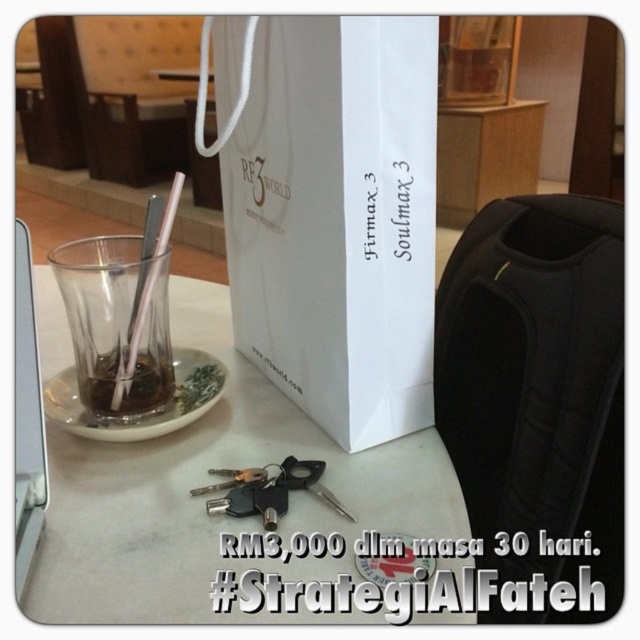
In the scene described, there is a transparent glass at center and a translucent glass cup at center. Which of these two items is larger in size?

The transparent glass at center is bigger than the translucent glass cup at center.

You are sitting at the table in the image and want to grab the transparent glass at center to drink from it. However, there is also a translucent glass cup at center nearby. Which one is easier to reach without moving your arm too much?

The transparent glass at center is closer to the viewer, so it would be easier to reach without moving your arm too much compared to the translucent glass cup at center.

You are a photographer adjusting your camera to focus on two points on the table. The first point is at coordinates point (x=138, y=396) and the second point is at point (x=104, y=401). Which point should you focus on first if you want to ensure both are in focus?

You should focus on point (x=138, y=396) first because it is closer to the camera than point (x=104, y=401). This ensures that both points will be in focus when adjusting the camera.